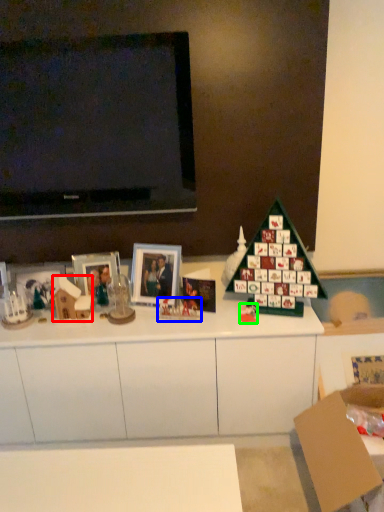
Question: Which object is positioned farthest from toy (highlighted by a red box)? Select from toy (highlighted by a blue box) and toy (highlighted by a green box).

Choices:
 (A) toy
 (B) toy

Answer: (B)